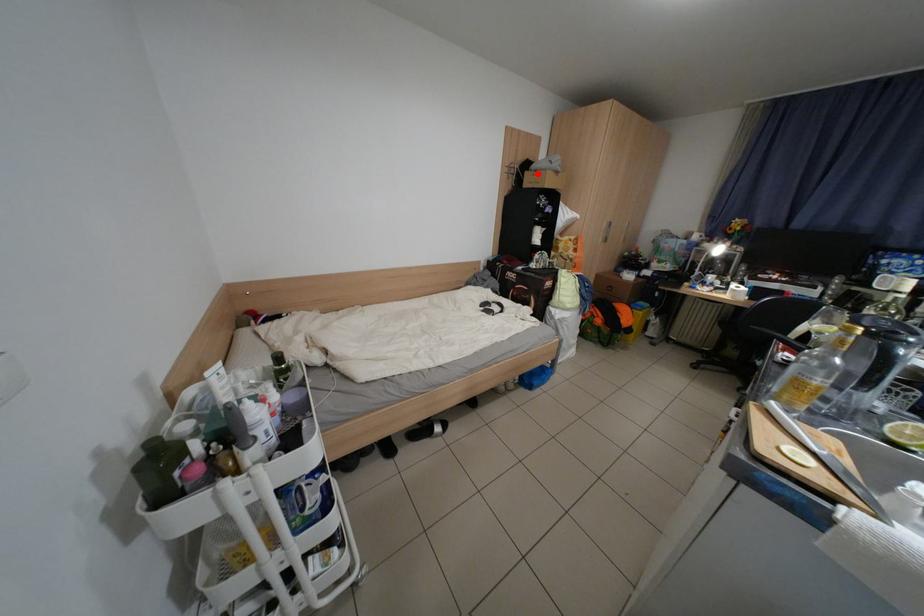
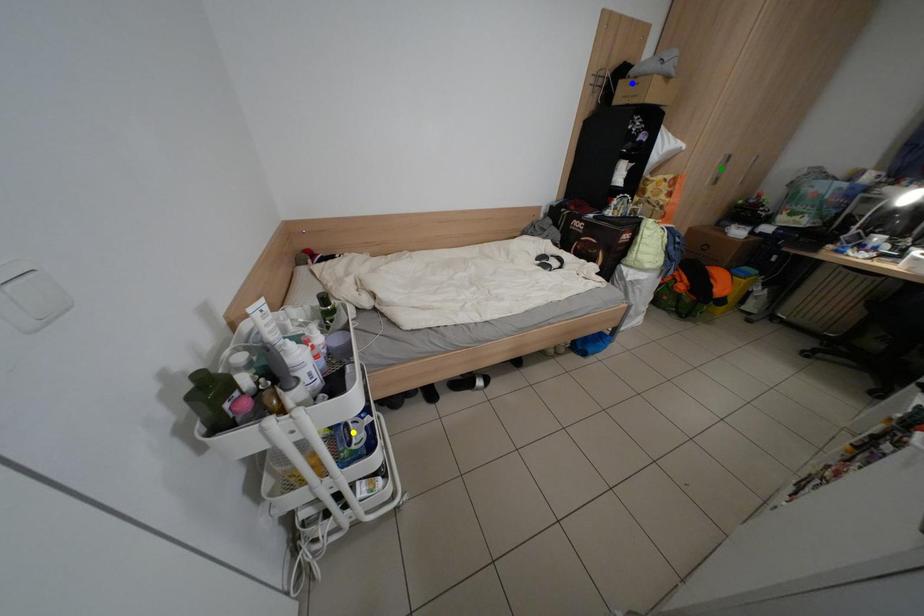
Question: I am providing you with two images of the same scene from different viewpoints. A red point is marked on the first image. You are given multiple points on the second image. In image 2, which mark is for the same physical point as the one in image 1?

Choices:
 (A) green point
 (B) yellow point
 (C) blue point

Answer: (C)